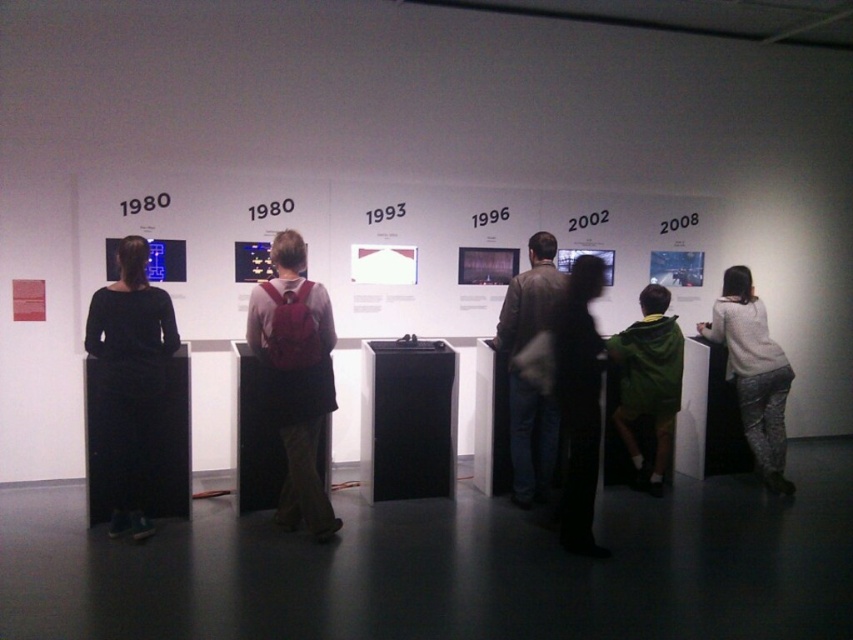
Question: Which point appears farthest from the camera in this image?

Choices:
 (A) (648, 401)
 (B) (759, 364)

Answer: (B)

Question: Can you confirm if leather jacket at center is positioned to the left of green hoodie at center?

Choices:
 (A) yes
 (B) no

Answer: (A)

Question: From the image, what is the correct spatial relationship of matte red backpack at center in relation to black dress at left?

Choices:
 (A) right
 (B) left

Answer: (A)

Question: Observing the image, what is the correct spatial positioning of leather jacket at center in reference to white sweater at right?

Choices:
 (A) left
 (B) right

Answer: (A)

Question: Which of the following is the farthest from the observer?

Choices:
 (A) (556, 424)
 (B) (738, 352)
 (C) (579, 522)

Answer: (B)

Question: Which object is the closest to the black dress at left?

Choices:
 (A) leather jacket at center
 (B) white sweater at right
 (C) dark fabric dress at center

Answer: (A)